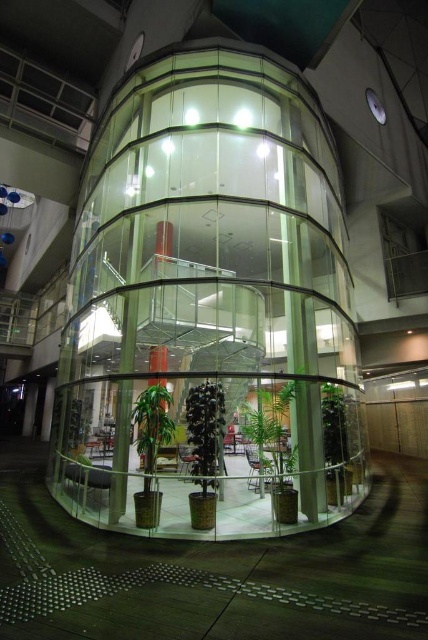
Which is more to the right, green glossy plant at center or green matte plant at center?

green glossy plant at center is more to the right.

Find the location of a particular element. The height and width of the screenshot is (640, 428). green glossy plant at center is located at coordinates (205, 432).